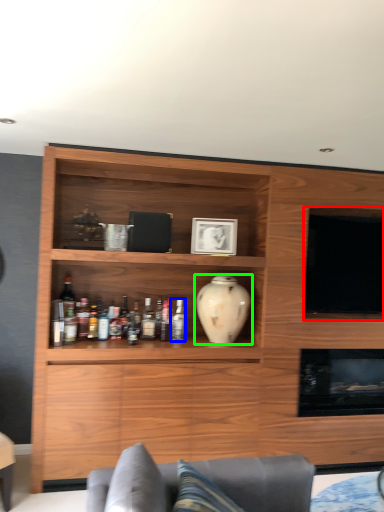
Question: Which object is positioned closest to television (highlighted by a red box)? Select from bottle (highlighted by a blue box) and vase (highlighted by a green box).

Choices:
 (A) bottle
 (B) vase

Answer: (B)